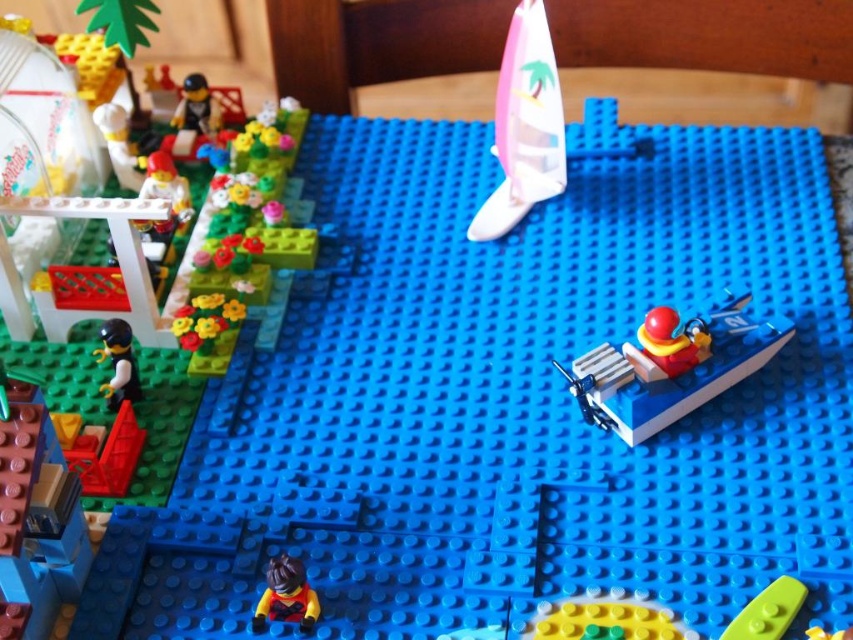
You are a LEGO enthusiast trying to place a new LEGO set on the blue baseplate. You have a green plastic boat at lower right and a black plastic minifigure at upper left. Which object should you avoid placing a larger accessory next to if you want to ensure it doesn

The green plastic boat at lower right is smaller than the black plastic minifigure at upper left. Therefore, you should avoid placing a larger accessory next to the green plastic boat at lower right to ensure it doesn

You are a LEGO figure trying to reach the green plastic boat at lower right from the black plastic minifigure at upper left. Can you step onto the boat without bending down?

The green plastic boat at lower right is shorter than the black plastic minifigure at upper left, so the minifigure would need to bend down to step onto the boat since the boat is lower in height.